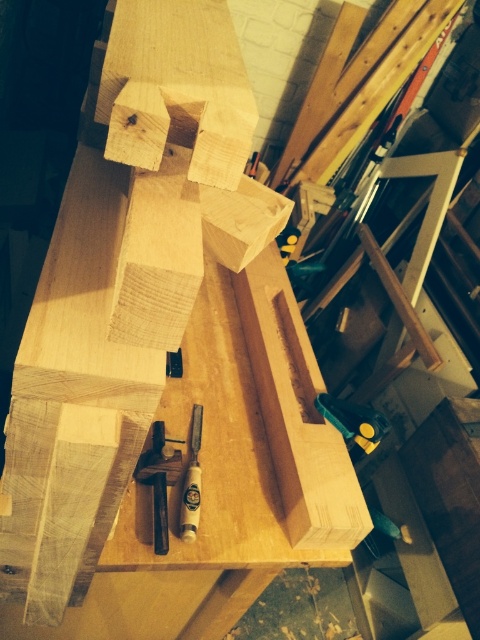
You are standing in a woodworking workshop and see a point marked at coordinates (348, 436). If you want to reach this point with a 3.5 feet long tool, will you be able to do so?

The point at (348, 436) is 4.32 feet away from the viewer. Since the tool is only 3.5 feet long, it is shorter than the required distance. Therefore, you cannot reach the point with this tool.

You are a carpenter working on a project and need to choose between the matte black chisel at center and the metallic yellow clamp at lower right. Which tool is bigger?

The matte black chisel at center is larger in size than the metallic yellow clamp at lower right.

You are a carpenter working on a project and need to choose between the matte black chisel at center and the wooden chisel at center. Which one is located to the left?

The matte black chisel at center is positioned on the left side of wooden chisel at center, so the matte black chisel at center is located to the left.